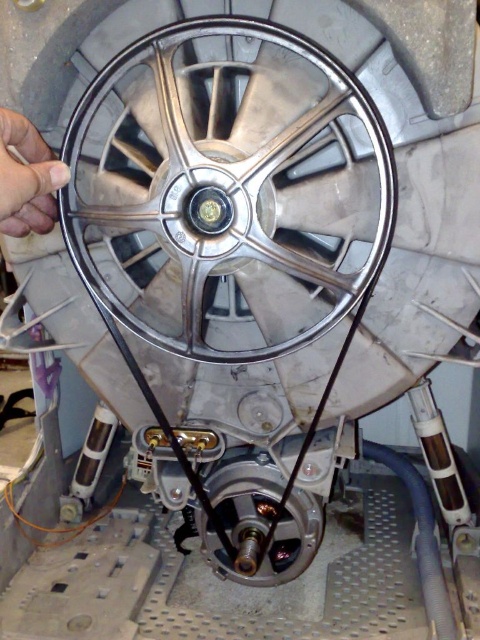
You are an engineer inspecting a mechanical assembly. You notice two components labeled as the polished silver rim at center and the metallic silver gear at center. Which component would you need to adjust first if you want to make a minor positional change to the part that is farther away from you?

You should adjust the metallic silver gear at center first because it is farther from the viewer compared to the polished silver rim at center, so modifying it directly would allow for precise positional changes.

You are a technician working on a machine. You need to replace a belt that connects the polished silver rim at center and the metallic silver gear at center. The belt you have is 22 inches long. Will the belt be long enough?

The distance between the polished silver rim at center and the metallic silver gear at center is 23.19 inches. The belt is only 22 inches long, so it will not be long enough to connect them.